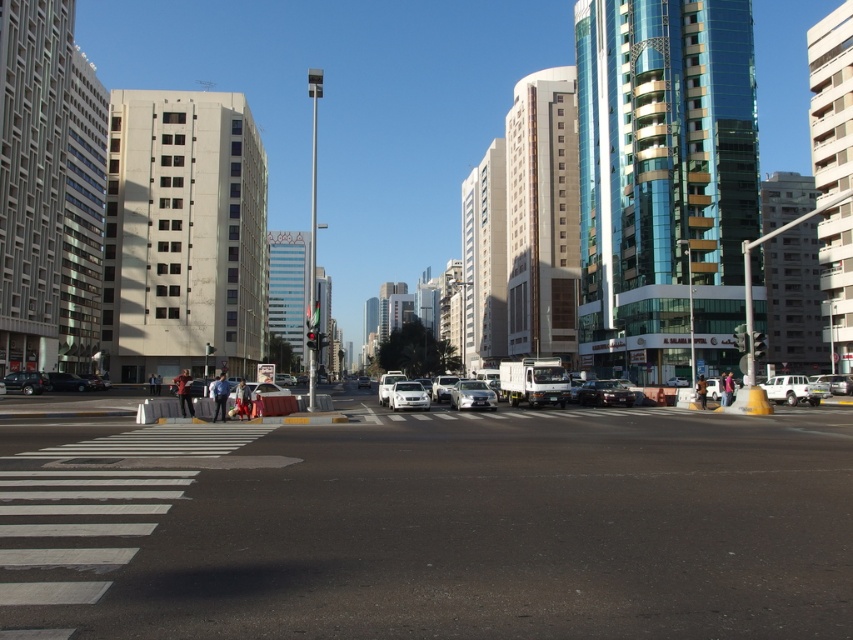
Find the location of a particular element. The height and width of the screenshot is (640, 853). white matte car at center is located at coordinates (408, 396).

Is white matte car at center thinner than matte black car at lower left?

Indeed, white matte car at center has a lesser width compared to matte black car at lower left.

The width and height of the screenshot is (853, 640). Describe the element at coordinates (408, 396) in the screenshot. I see `white matte car at center` at that location.

Locate an element on the screen. white matte car at center is located at coordinates (408, 396).

Is black asphalt road at center wider than matte black car at lower left?

Correct, the width of black asphalt road at center exceeds that of matte black car at lower left.

I want to click on black asphalt road at center, so click(x=430, y=525).

Describe the element at coordinates (430, 525) in the screenshot. I see `black asphalt road at center` at that location.

Locate an element on the screen. The image size is (853, 640). black asphalt road at center is located at coordinates (430, 525).

Is black asphalt road at center to the right of white matte suv at lower right from the viewer's perspective?

No, black asphalt road at center is not to the right of white matte suv at lower right.

Is point (231, 522) farther from viewer compared to point (811, 404)?

No, it is in front of (811, 404).

Between point (759, 532) and point (769, 387), which one is positioned behind?

Point (769, 387)

Where is `black asphalt road at center`? This screenshot has width=853, height=640. black asphalt road at center is located at coordinates (430, 525).